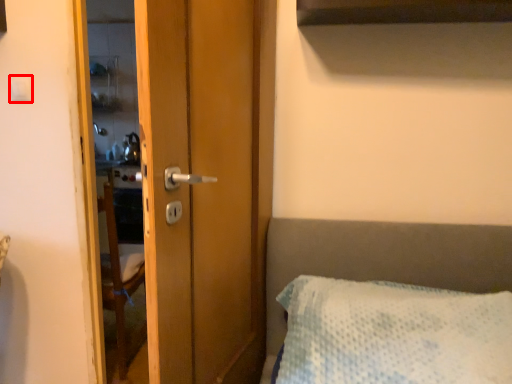
Question: Considering the relative positions of light switch (annotated by the red box) and screen door in the image provided, where is light switch (annotated by the red box) located with respect to the staircase?

Choices:
 (A) left
 (B) right

Answer: (A)